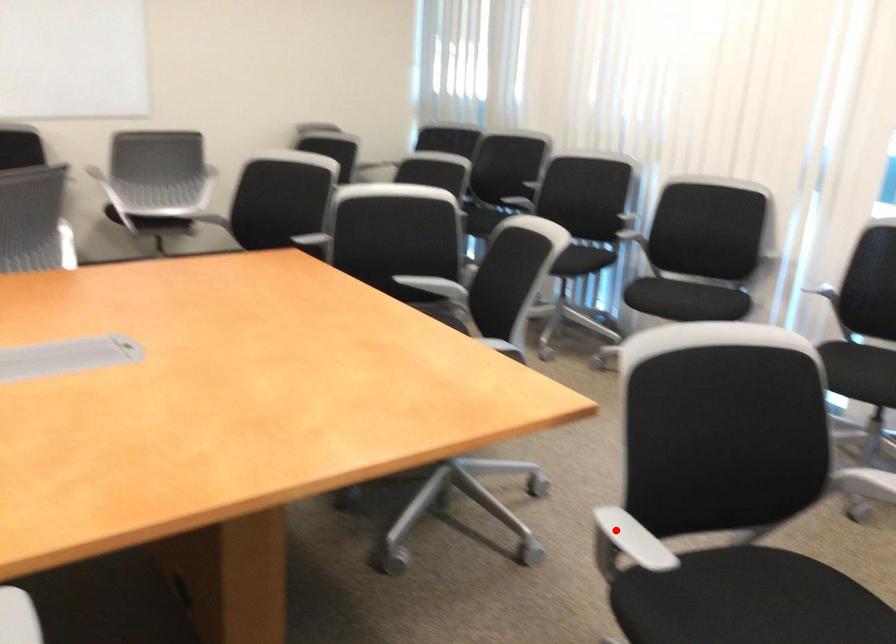
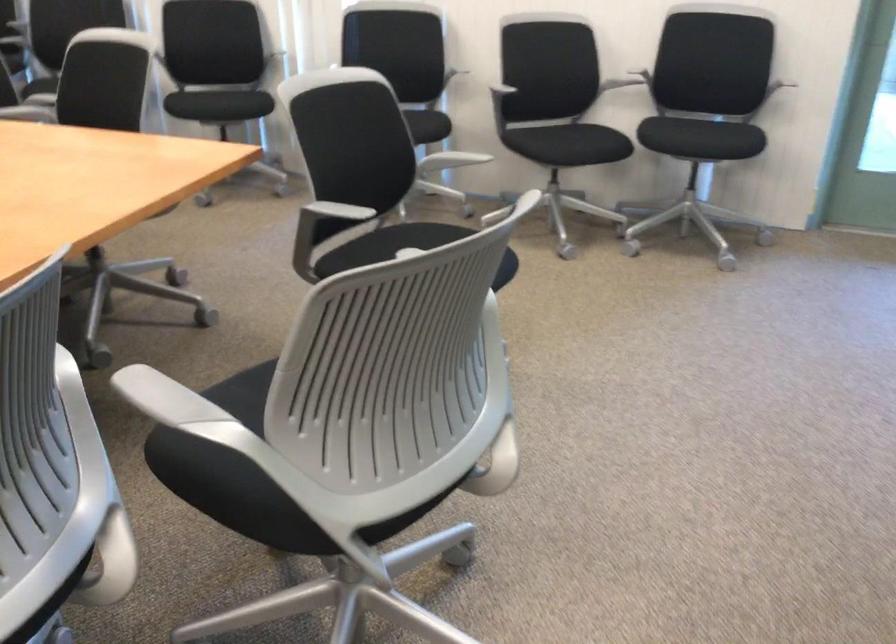
Question: A red point is marked in image1. In image2, is the corresponding 3D point closer to the camera or farther? Reply with the corresponding letter.

Choices:
 (A) The corresponding 3D point is closer.
 (B) The corresponding 3D point is farther.

Answer: (B)